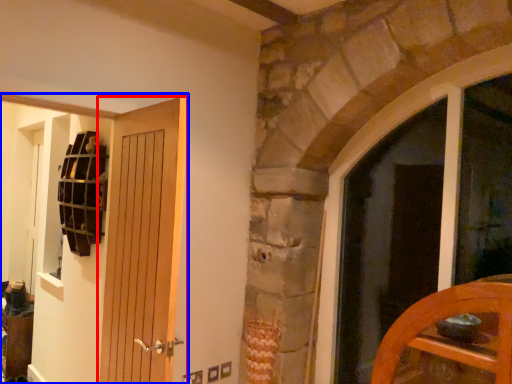
Question: Which object appears closest to the camera in this image, door (highlighted by a red box) or door (highlighted by a blue box)?

Choices:
 (A) door
 (B) door

Answer: (A)